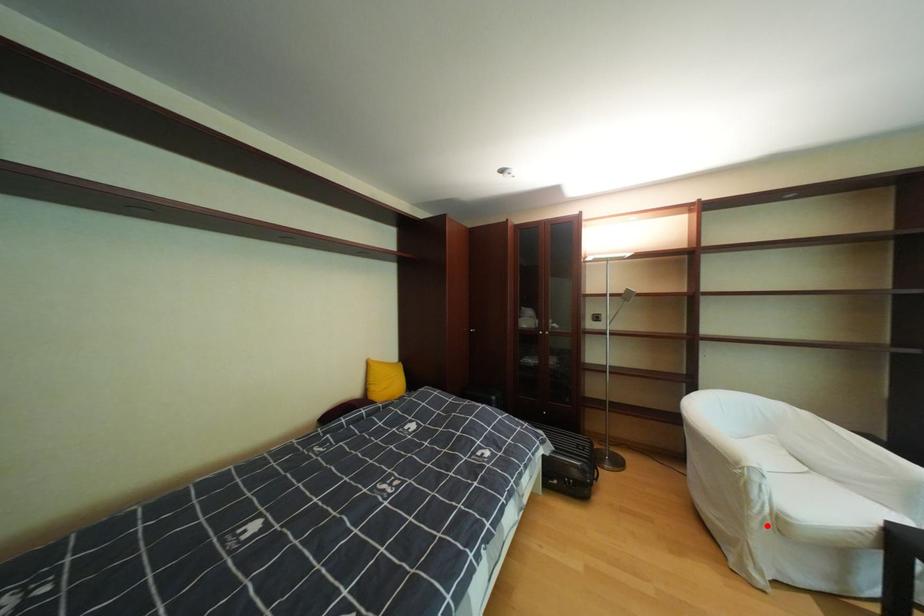
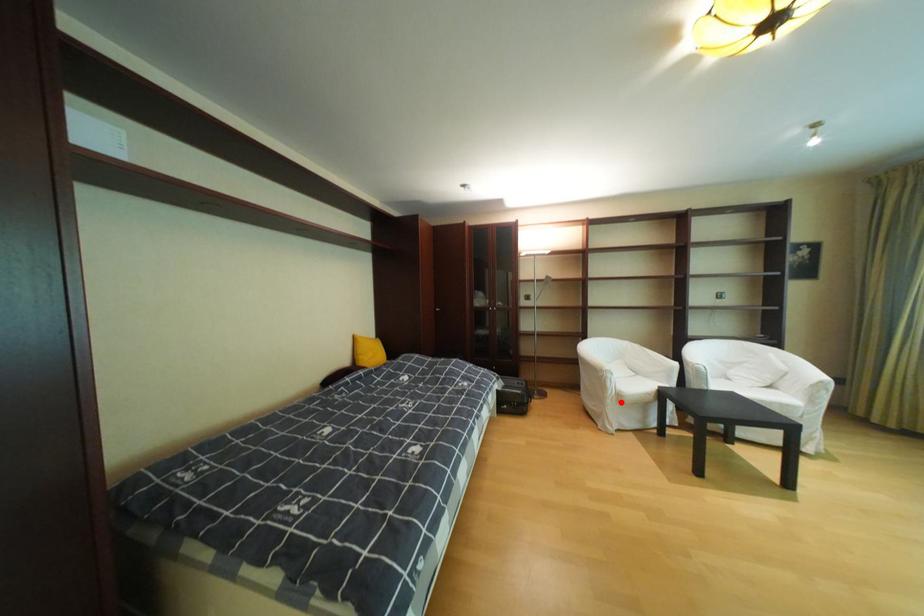
I am providing you with two images of the same scene from different viewpoints. A red point is marked on the first image and another point is marked on the second image. Do the highlighted points in image1 and image2 indicate the same real-world spot?

Yes